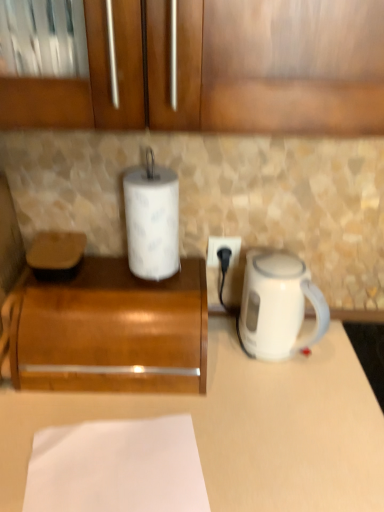
You are a GUI agent. You are given a task and a screenshot of the screen. Output one action in this format:
    pyautogui.click(x=<x>, y=<y>)
    Task: Click on the vacant point to the right of wooden at left
    The image size is (384, 512).
    Given the screenshot: What is the action you would take?
    tap(251, 395)